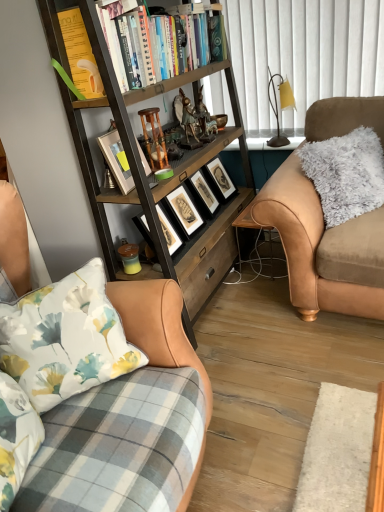
This screenshot has width=384, height=512. Identify the location of fuzzy beige couch at right, the second studio couch viewed from the front. (323, 248).

Measure the distance between point [316,283] and camera.

The distance of point [316,283] from camera is 6.31 feet.

This screenshot has height=512, width=384. Describe the element at coordinates (252, 228) in the screenshot. I see `brown leather desk at center` at that location.

Identify the location of brown leather desk at center. (252, 228).

Measure the distance between point (193, 66) and camera.

A distance of 2.19 meters exists between point (193, 66) and camera.

What do you see at coordinates (116, 160) in the screenshot? The image size is (384, 512). I see `wooden picture frame at upper center, positioned as the 1th picture frame in left-to-right order` at bounding box center [116, 160].

What do you see at coordinates (130, 258) in the screenshot?
I see `yellow matte candle at lower center` at bounding box center [130, 258].

This screenshot has height=512, width=384. I want to click on fuzzy beige couch at right, the first studio couch positioned from the right, so click(323, 248).

Which object is positioned more to the right, wooden picture frame at upper center, positioned as the 1th picture frame in left-to-right order, or brown leather desk at center?

brown leather desk at center is more to the right.

How many degrees apart are the facing directions of wooden picture frame at upper center, positioned as the 2th picture frame in right-to-left order, and brown leather desk at center?

They differ by 99 degrees in their facing directions.

Is the surface of wooden picture frame at upper center, which appears as the first picture frame when viewed from the front, in direct contact with brown leather desk at center?

No.

From the image's perspective, who appears lower, black matte picture frame at center, which appears as the second picture frame when viewed from the left, or wooden picture frame at upper center, placed as the 2th picture frame when sorted from back to front?

black matte picture frame at center, which appears as the second picture frame when viewed from the left, appears lower in the image.

Would you say wooden picture frame at upper center, positioned as the 1th picture frame in left-to-right order, is part of black matte picture frame at center, which ranks as the first picture frame in right-to-left order,'s contents?

Actually, wooden picture frame at upper center, positioned as the 1th picture frame in left-to-right order, is outside black matte picture frame at center, which ranks as the first picture frame in right-to-left order.

Does black matte picture frame at center, which appears as the second picture frame when viewed from the left, have a lesser width compared to wooden picture frame at upper center, positioned as the 2th picture frame in right-to-left order?

No, black matte picture frame at center, which appears as the second picture frame when viewed from the left, is not thinner than wooden picture frame at upper center, positioned as the 2th picture frame in right-to-left order.

Consider the image. Is black matte picture frame at center, marked as the second picture frame in a front-to-back arrangement, bigger or smaller than wooden picture frame at upper center, placed as the 2th picture frame when sorted from back to front?

black matte picture frame at center, marked as the second picture frame in a front-to-back arrangement, is bigger than wooden picture frame at upper center, placed as the 2th picture frame when sorted from back to front.

Is black matte picture frame at center, acting as the first picture frame starting from the back, shorter than yellow matte candle at lower center?

Incorrect, the height of black matte picture frame at center, acting as the first picture frame starting from the back, does not fall short of that of yellow matte candle at lower center.

From a real-world perspective, is black matte picture frame at center, acting as the first picture frame starting from the back, beneath yellow matte candle at lower center?

No, from a real-world perspective, black matte picture frame at center, acting as the first picture frame starting from the back, is not below yellow matte candle at lower center.

This screenshot has height=512, width=384. What are the coordinates of `coffee cup lying below the black matte picture frame at center, acting as the first picture frame starting from the back (from the image's perspective)` in the screenshot? It's located at (130, 258).

From a real-world perspective, is black matte picture frame at center, marked as the second picture frame in a front-to-back arrangement, on wooden bookcase at left?

No, from a real-world perspective, black matte picture frame at center, marked as the second picture frame in a front-to-back arrangement, is not on top of wooden bookcase at left.

Which of these two, black matte picture frame at center, marked as the second picture frame in a front-to-back arrangement, or wooden bookcase at left, is smaller?

black matte picture frame at center, marked as the second picture frame in a front-to-back arrangement, is smaller.

From the image's perspective, is black matte picture frame at center, marked as the second picture frame in a front-to-back arrangement, under wooden bookcase at left?

Correct, black matte picture frame at center, marked as the second picture frame in a front-to-back arrangement, appears lower than wooden bookcase at left in the image.

Would you say black matte picture frame at center, which appears as the second picture frame when viewed from the left, is outside wooden bookcase at left?

No, black matte picture frame at center, which appears as the second picture frame when viewed from the left, is not entirely external to wooden bookcase at left.

Considering the sizes of objects metallic gold lamp at upper right and yellow matte candle at lower center in the image provided, who is taller, metallic gold lamp at upper right or yellow matte candle at lower center?

metallic gold lamp at upper right.

From a real-world perspective, which object rests below the other?

yellow matte candle at lower center is physically lower.

From the image's perspective, is metallic gold lamp at upper right under yellow matte candle at lower center?

Incorrect, from the image's perspective, metallic gold lamp at upper right is higher than yellow matte candle at lower center.

Between metallic gold lamp at upper right and yellow matte candle at lower center, which one is positioned behind?

metallic gold lamp at upper right is behind.

In the image, there is a wooden picture frame at upper center, positioned as the 2th picture frame in right-to-left order. Identify the location of bookcase below it (from a real-world perspective). (143, 168).

From a real-world perspective, which object rests below the other?

wooden bookcase at left.

Considering the sizes of wooden picture frame at upper center, placed as the 2th picture frame when sorted from back to front, and wooden bookcase at left in the image, is wooden picture frame at upper center, placed as the 2th picture frame when sorted from back to front, bigger or smaller than wooden bookcase at left?

wooden picture frame at upper center, placed as the 2th picture frame when sorted from back to front, is smaller than wooden bookcase at left.

Consider the image. Does yellow matte candle at lower center have a smaller size compared to brown leather couch at left, positioned as the first studio couch in left-to-right order?

Yes.

Between yellow matte candle at lower center and brown leather couch at left, which is the first studio couch in front-to-back order, which one has more height?

brown leather couch at left, which is the first studio couch in front-to-back order.

From a real-world perspective, who is located lower, yellow matte candle at lower center or brown leather couch at left, which is counted as the second studio couch, starting from the right?

From a 3D spatial view, yellow matte candle at lower center is below.

Is yellow matte candle at lower center far away from brown leather couch at left, positioned as the first studio couch in left-to-right order?

Actually, yellow matte candle at lower center and brown leather couch at left, positioned as the first studio couch in left-to-right order, are a little close together.

Where is `the 2nd picture frame to the left of the brown leather desk at center, counting from the anchor's position`? This screenshot has width=384, height=512. the 2nd picture frame to the left of the brown leather desk at center, counting from the anchor's position is located at coordinates (116, 160).

Image resolution: width=384 pixels, height=512 pixels. What are the coordinates of `picture frame located on the right of wooden picture frame at upper center, positioned as the 2th picture frame in right-to-left order` in the screenshot? It's located at (203, 194).

Looking at the image, which one is located closer to black matte picture frame at center, acting as the first picture frame starting from the back, brown leather desk at center or wooden picture frame at upper center, positioned as the 2th picture frame in right-to-left order?

The object closer to black matte picture frame at center, acting as the first picture frame starting from the back, is brown leather desk at center.

Based on their spatial positions, is white textured curtain at upper center or fuzzy beige couch at right, marked as the second studio couch in a left-to-right arrangement, further from wooden bookcase at left?

Among the two, white textured curtain at upper center is located further to wooden bookcase at left.

Which object lies nearer to the anchor point yellow matte candle at lower center, black matte picture frame at center, marked as the second picture frame in a front-to-back arrangement, or white textured curtain at upper center?

Among the two, black matte picture frame at center, marked as the second picture frame in a front-to-back arrangement, is located nearer to yellow matte candle at lower center.

Considering their positions, is wooden bookcase at left positioned further to brown leather couch at left, which is counted as the second studio couch, starting from the right, than fuzzy beige couch at right, the first studio couch positioned from the right?

fuzzy beige couch at right, the first studio couch positioned from the right, is further to brown leather couch at left, which is counted as the second studio couch, starting from the right.

Looking at the image, which one is located further to white textured curtain at upper center, hardcover books at upper center or wooden picture frame at upper center, positioned as the 2th picture frame in right-to-left order?

Among the two, wooden picture frame at upper center, positioned as the 2th picture frame in right-to-left order, is located further to white textured curtain at upper center.

Estimate the real-world distances between objects in this image. Which object is closer to black matte picture frame at center, which ranks as the first picture frame in right-to-left order, wooden picture frame at upper center, positioned as the 1th picture frame in left-to-right order, or brown leather desk at center?

Among the two, brown leather desk at center is located nearer to black matte picture frame at center, which ranks as the first picture frame in right-to-left order.

When comparing their distances from white textured curtain at upper center, does wooden bookcase at left or brown leather desk at center seem further?

brown leather desk at center is positioned further to the anchor white textured curtain at upper center.

From the image, which object appears to be nearer to wooden bookcase at left, brown leather couch at left, positioned as the first studio couch in left-to-right order, or white textured curtain at upper center?

Result: Among the two, white textured curtain at upper center is located nearer to wooden bookcase at left.

At what (x,y) coordinates should I click in order to perform the action: click on picture frame between wooden picture frame at upper center, which appears as the first picture frame when viewed from the front, and fuzzy beige couch at right, marked as the second studio couch in a left-to-right arrangement. Please return your answer as a coordinate pair (x, y). Looking at the image, I should click on (203, 194).

Locate an element on the screen. Image resolution: width=384 pixels, height=512 pixels. lamp between hardcover books at upper center and white textured curtain at upper center is located at coordinates (277, 106).

In order to click on book between brown leather couch at left, which is counted as the second studio couch, starting from the right, and metallic gold lamp at upper right in the front-back direction in this screenshot , I will do `click(140, 49)`.

Identify the location of picture frame between hardcover books at upper center and fuzzy beige couch at right, the first studio couch positioned from the right. (203, 194).